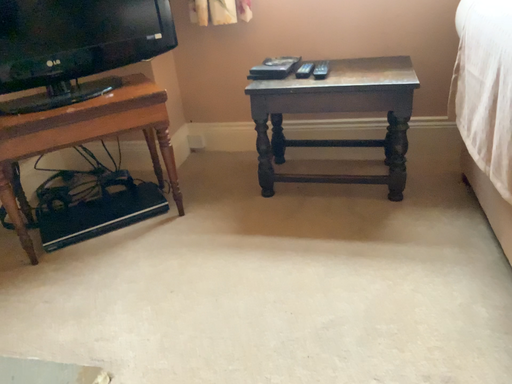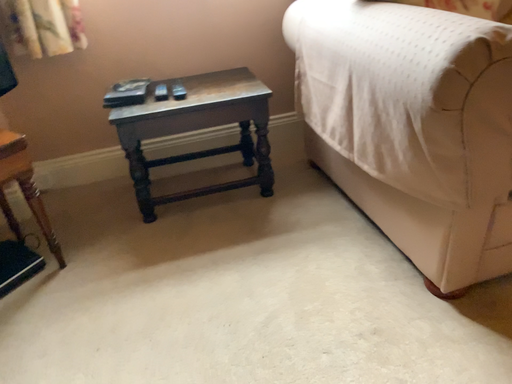
Question: How did the camera likely rotate when shooting the video?

Choices:
 (A) rotated right
 (B) rotated left

Answer: (A)